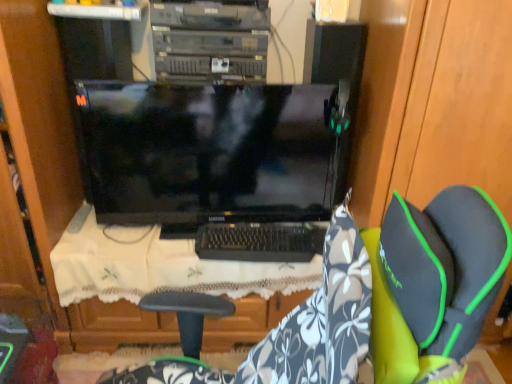
Question: Does wooden dresser at left have a greater width compared to black plastic keyboard at center?

Choices:
 (A) no
 (B) yes

Answer: (B)

Question: Considering the relative positions of wooden dresser at left and black plastic keyboard at center in the image provided, is wooden dresser at left in front of black plastic keyboard at center?

Choices:
 (A) no
 (B) yes

Answer: (B)

Question: Is wooden dresser at left taller than black plastic keyboard at center?

Choices:
 (A) no
 (B) yes

Answer: (B)

Question: From a real-world perspective, is wooden dresser at left physically above black plastic keyboard at center?

Choices:
 (A) no
 (B) yes

Answer: (B)

Question: Is wooden dresser at left at the left side of black plastic keyboard at center?

Choices:
 (A) no
 (B) yes

Answer: (B)

Question: Choose the correct answer: Is black glossy monitor at center inside wooden dresser at left or outside it?

Choices:
 (A) inside
 (B) outside

Answer: (B)

Question: Considering the positions of point (136, 105) and point (71, 337), is point (136, 105) closer or farther from the camera than point (71, 337)?

Choices:
 (A) farther
 (B) closer

Answer: (B)

Question: From the image's perspective, relative to wooden dresser at left, is black glossy monitor at center above or below?

Choices:
 (A) below
 (B) above

Answer: (B)

Question: In the image, is black glossy monitor at center positioned in front of or behind wooden dresser at left?

Choices:
 (A) front
 (B) behind

Answer: (B)

Question: From a real-world perspective, is black plastic keyboard at center above or below white lace cloth at center?

Choices:
 (A) below
 (B) above

Answer: (B)

Question: Is black plastic keyboard at center taller or shorter than white lace cloth at center?

Choices:
 (A) short
 (B) tall

Answer: (A)

Question: Is black plastic keyboard at center inside or outside of white lace cloth at center?

Choices:
 (A) inside
 (B) outside

Answer: (B)

Question: Is black plastic keyboard at center to the left or to the right of white lace cloth at center in the image?

Choices:
 (A) left
 (B) right

Answer: (B)

Question: Is white lace cloth at center to the left or to the right of wooden dresser at left in the image?

Choices:
 (A) right
 (B) left

Answer: (A)

Question: From a real-world perspective, is white lace cloth at center physically located above or below wooden dresser at left?

Choices:
 (A) above
 (B) below

Answer: (B)